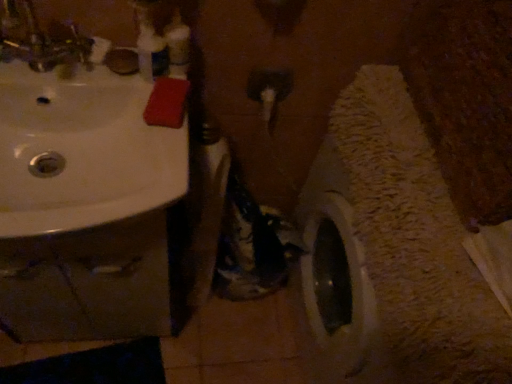
This screenshot has width=512, height=384. In order to click on vacant position to the left of translucent plastic bottle at upper center in this screenshot , I will do 66,71.